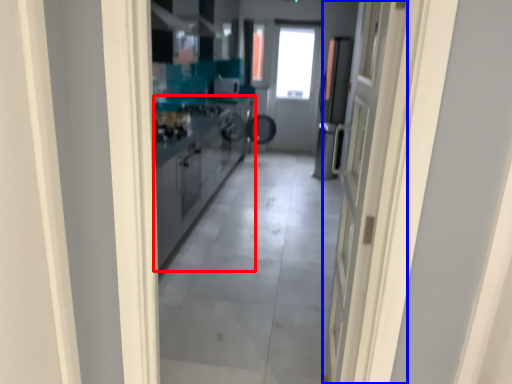
Question: Which object appears farthest to the camera in this image, cabinetry (highlighted by a red box) or door (highlighted by a blue box)?

Choices:
 (A) cabinetry
 (B) door

Answer: (A)